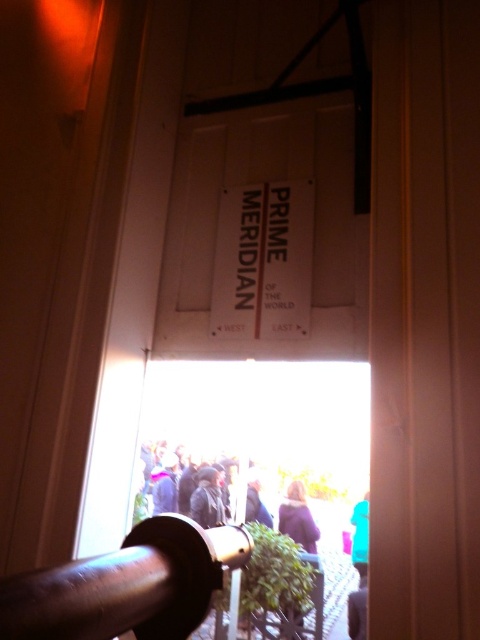
In the scene shown: Between dark brown hair at center and blue fabric person at lower right, which one has less height?

dark brown hair at center is shorter.

Is the position of dark brown hair at center less distant than that of blue fabric person at lower right?

No, dark brown hair at center is behind blue fabric person at lower right.

The width and height of the screenshot is (480, 640). What do you see at coordinates (298, 518) in the screenshot?
I see `dark brown hair at center` at bounding box center [298, 518].

The image size is (480, 640). What are the coordinates of `dark brown hair at center` in the screenshot? It's located at (298, 518).

How far apart are blue fabric person at lower right and dark gray fabric at lower right?

blue fabric person at lower right and dark gray fabric at lower right are 10.15 inches apart from each other.

Who is higher up, blue fabric person at lower right or dark gray fabric at lower right?

Positioned higher is blue fabric person at lower right.

Is point (363, 502) in front of point (348, 600)?

No, it is not.

This screenshot has width=480, height=640. In order to click on blue fabric person at lower right in this screenshot , I will do `click(360, 538)`.

Between dark brown hair at center and dark gray fabric at lower right, which one has less height?

With less height is dark gray fabric at lower right.

In the scene shown: Does dark brown hair at center have a greater width compared to dark gray fabric at lower right?

Yes, dark brown hair at center is wider than dark gray fabric at lower right.

Locate an element on the screen. This screenshot has height=640, width=480. dark brown hair at center is located at coordinates [x=298, y=518].